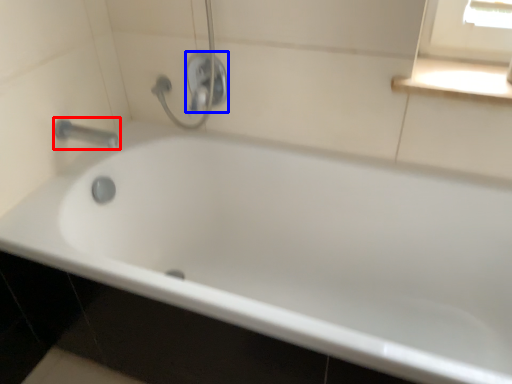
Question: Which of the following is the closest to the observer, tap (highlighted by a red box) or shower (highlighted by a blue box)?

Choices:
 (A) tap
 (B) shower

Answer: (A)